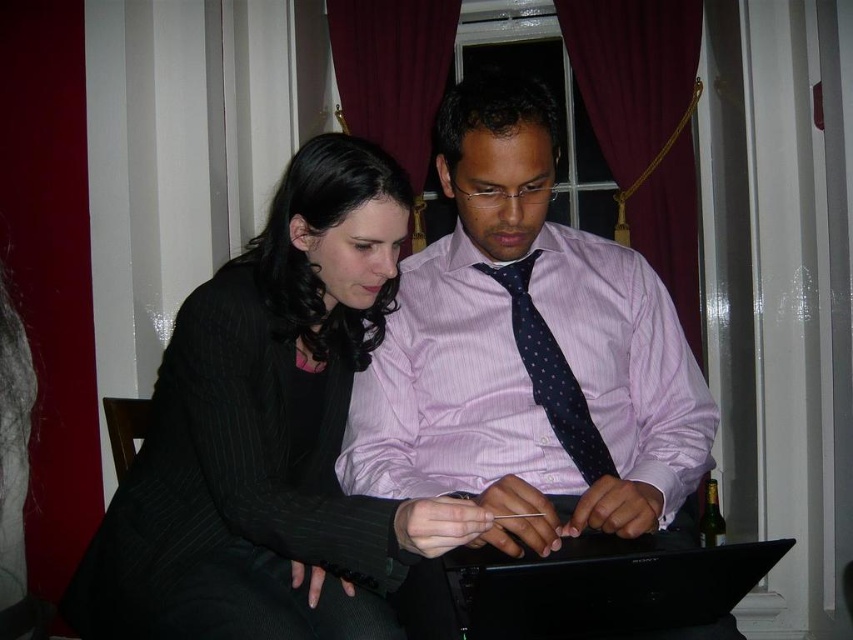
Which is below, pink striped dress shirt at center or dark blue dotted tie at center?

pink striped dress shirt at center

Does point (428, 458) come farther from viewer compared to point (550, 428)?

Yes.

Identify the location of pink striped dress shirt at center. This screenshot has width=853, height=640. (450, 390).

Is black pinstripe suit at center thinner than pink striped dress shirt at center?

No, black pinstripe suit at center is not thinner than pink striped dress shirt at center.

Is point (367, 310) positioned in front of point (434, 428)?

No.

Locate an element on the screen. The width and height of the screenshot is (853, 640). black pinstripe suit at center is located at coordinates (262, 456).

The width and height of the screenshot is (853, 640). Identify the location of black pinstripe suit at center. (262, 456).

At what (x,y) coordinates should I click in order to perform the action: click on black pinstripe suit at center. Please return your answer as a coordinate pair (x, y). Image resolution: width=853 pixels, height=640 pixels. Looking at the image, I should click on (262, 456).